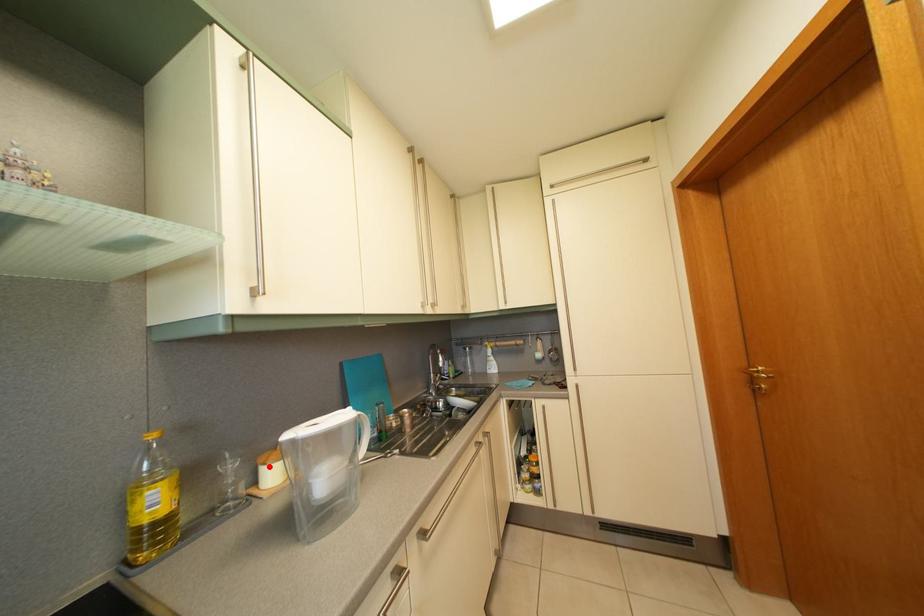
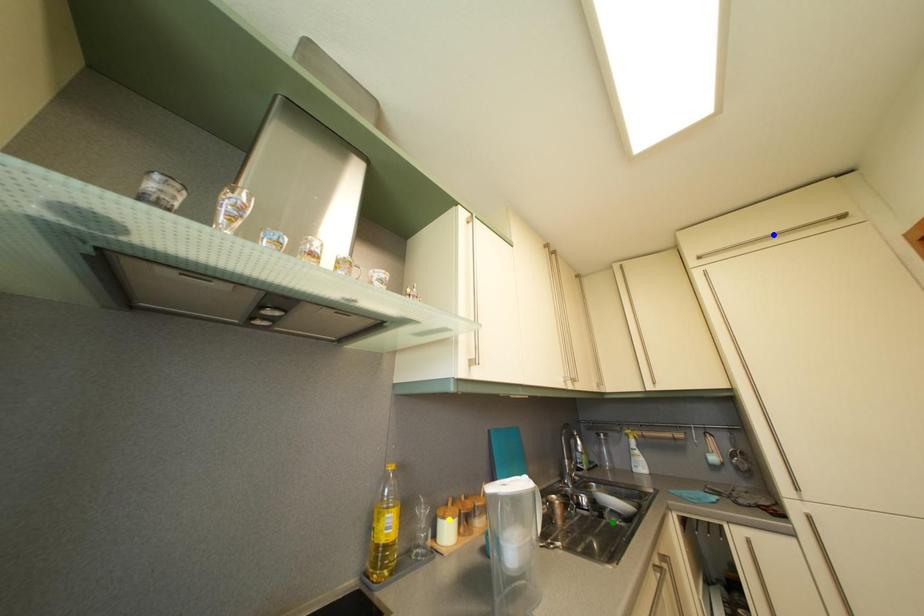
Question: I am providing you with two images of the same scene from different viewpoints. A red point is marked on the first image. You are given multiple points on the second image. Can you choose the point in image 2 that corresponds to the point in image 1?

Choices:
 (A) blue point
 (B) green point
 (C) yellow point

Answer: (C)